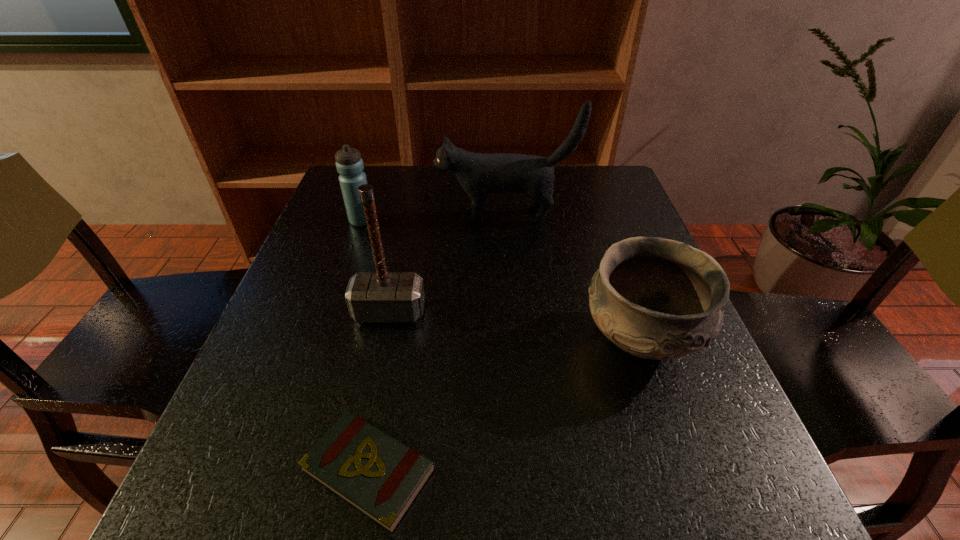
The width and height of the screenshot is (960, 540). I want to click on vacant region that satisfies the following two spatial constraints: 1. at the face of the pottery; 2. on the right side of the cat, so 515,340.

Locate an element on the screen. free space that satisfies the following two spatial constraints: 1. on the front side of the water bottle; 2. on the right side of the book is located at coordinates (276, 470).

I want to click on vacant space that satisfies the following two spatial constraints: 1. on the striking surface of the pottery; 2. on the left side of the hammer, so click(384, 340).